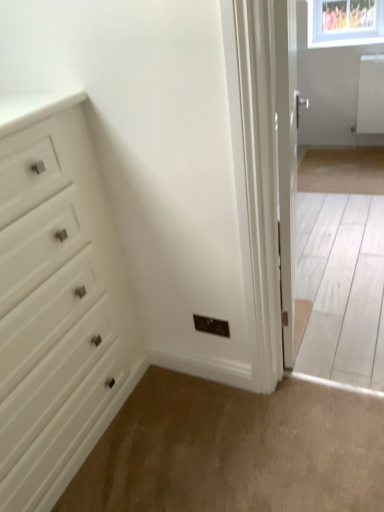
Question: Is white matte chest of drawers at left positioned before beige carpet at lower center?

Choices:
 (A) no
 (B) yes

Answer: (B)

Question: From a real-world perspective, is white matte chest of drawers at left over beige carpet at lower center?

Choices:
 (A) yes
 (B) no

Answer: (A)

Question: Is white matte chest of drawers at left to the right of beige carpet at lower center from the viewer's perspective?

Choices:
 (A) yes
 (B) no

Answer: (B)

Question: Can beige carpet at lower center be found inside white matte chest of drawers at left?

Choices:
 (A) yes
 (B) no

Answer: (B)

Question: From a real-world perspective, is white matte chest of drawers at left under beige carpet at lower center?

Choices:
 (A) yes
 (B) no

Answer: (B)

Question: From a real-world perspective, is beige carpet at lower center physically located above or below white glossy door at right?

Choices:
 (A) below
 (B) above

Answer: (A)

Question: Considering the positions of beige carpet at lower center and white glossy door at right in the image, is beige carpet at lower center taller or shorter than white glossy door at right?

Choices:
 (A) tall
 (B) short

Answer: (B)

Question: Does point (87, 475) appear closer or farther from the camera than point (296, 156)?

Choices:
 (A) farther
 (B) closer

Answer: (B)

Question: Is beige carpet at lower center bigger or smaller than white glossy door at right?

Choices:
 (A) small
 (B) big

Answer: (A)

Question: From the image's perspective, is white matte chest of drawers at left positioned above or below beige carpet at lower center?

Choices:
 (A) below
 (B) above

Answer: (B)

Question: From a real-world perspective, relative to beige carpet at lower center, is white matte chest of drawers at left vertically above or below?

Choices:
 (A) below
 (B) above

Answer: (B)

Question: Visually, is white matte chest of drawers at left positioned to the left or to the right of beige carpet at lower center?

Choices:
 (A) right
 (B) left

Answer: (B)

Question: Is point (16, 352) positioned closer to the camera than point (354, 490)?

Choices:
 (A) closer
 (B) farther

Answer: (A)

Question: Considering the positions of white glossy door at right and beige carpet at lower center in the image, is white glossy door at right wider or thinner than beige carpet at lower center?

Choices:
 (A) thin
 (B) wide

Answer: (A)

Question: From the image's perspective, is white glossy door at right positioned above or below beige carpet at lower center?

Choices:
 (A) below
 (B) above

Answer: (B)